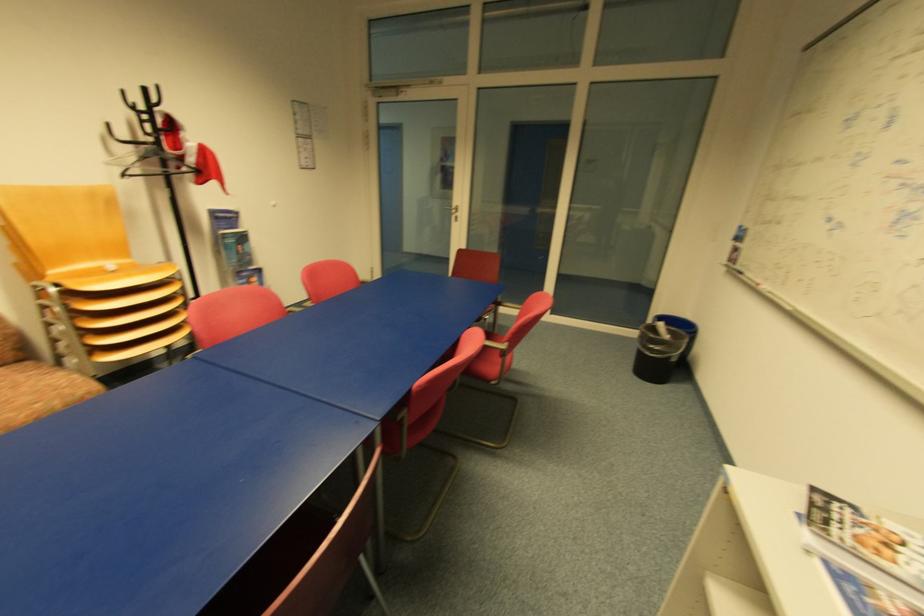
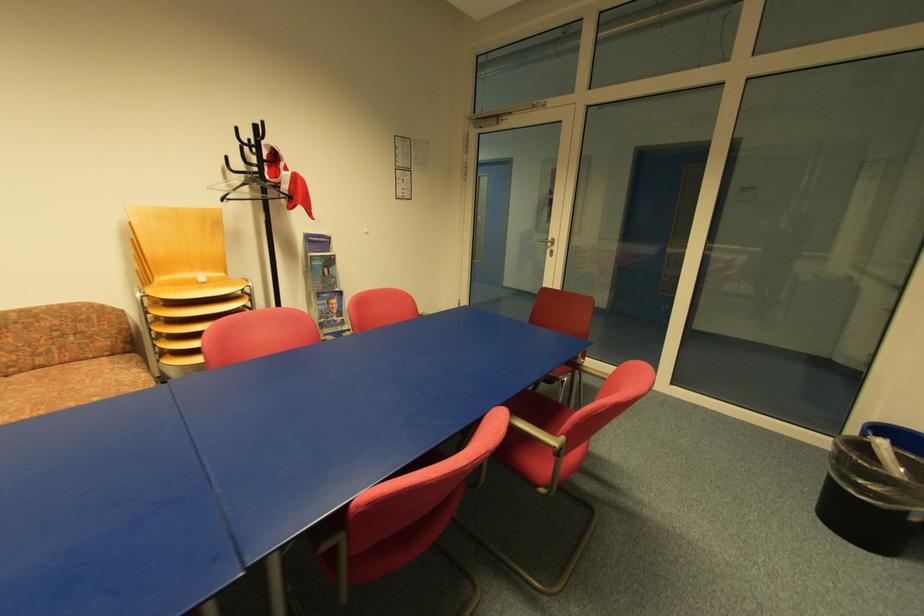
Where in the second image is the point corresponding to point (116, 274) from the first image?

(207, 285)